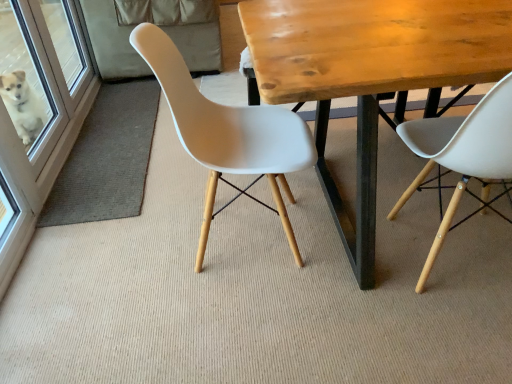
Question: In terms of size, does white plastic chair at right, the second chair in the left-to-right sequence, appear bigger or smaller than white plastic chair at center, the 1th chair positioned from the left?

Choices:
 (A) big
 (B) small

Answer: (B)

Question: In the image, is white plastic chair at right, the second chair in the left-to-right sequence, positioned in front of or behind white plastic chair at center, the 1th chair positioned from the left?

Choices:
 (A) behind
 (B) front

Answer: (B)

Question: Which is nearer to the wooden table at center?

Choices:
 (A) white plastic chair at right, the second chair in the left-to-right sequence
 (B) white glossy screen door at left
 (C) white plastic chair at center, the 1th chair positioned from the left

Answer: (A)

Question: Based on their relative distances, which object is nearer to the wooden table at center?

Choices:
 (A) white plastic chair at right, which is the 1th chair in right-to-left order
 (B) white glossy screen door at left
 (C) white plastic chair at center, the second chair viewed from the right

Answer: (A)